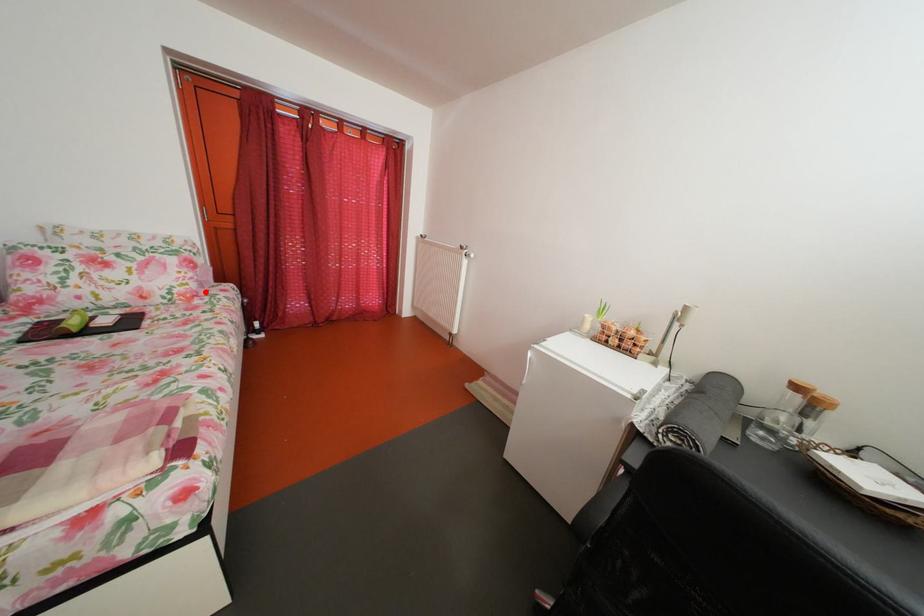
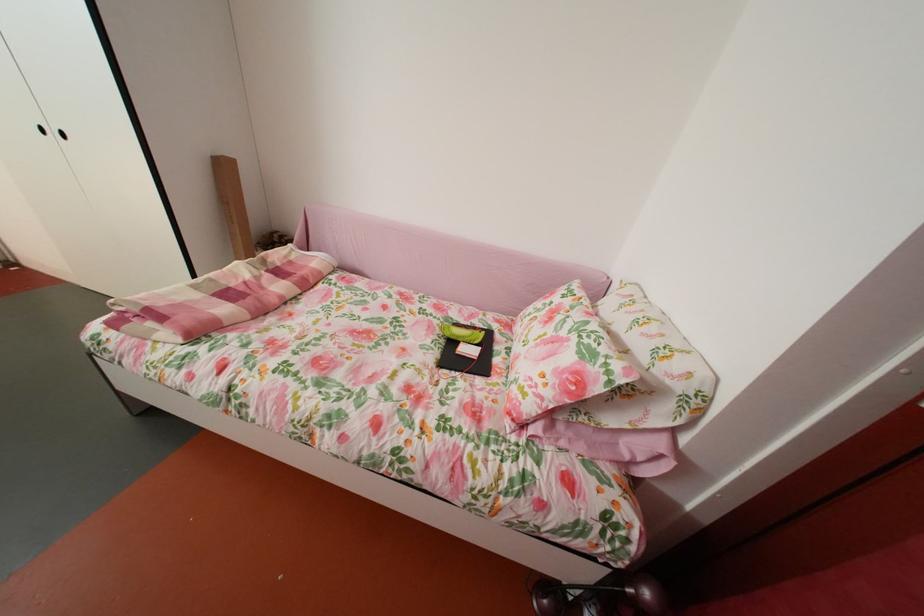
Locate, in the second image, the point that corresponds to the highlighted location in the first image.

(541, 413)